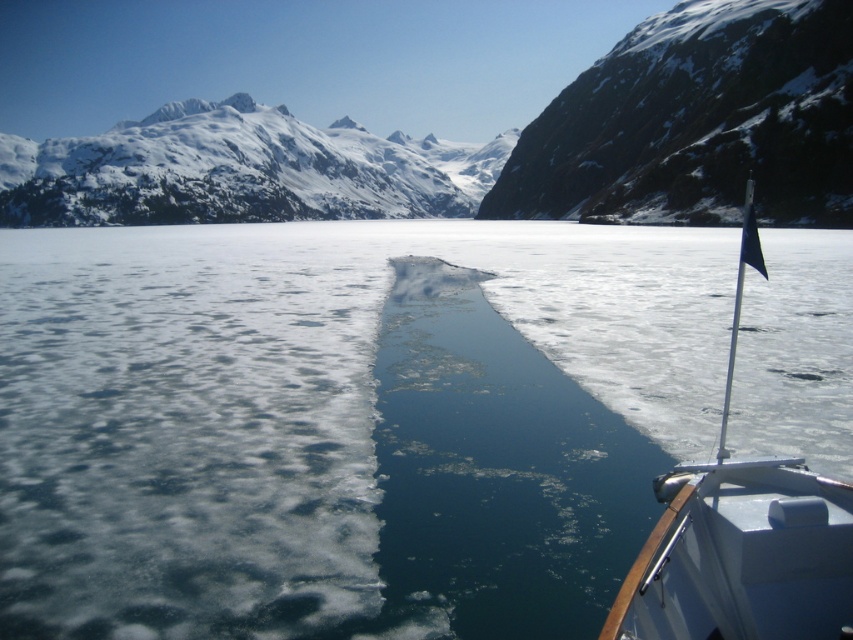
Is dark gray rocky cliff at upper right thinner than snowy granite mountain at upper left?

Yes, dark gray rocky cliff at upper right is thinner than snowy granite mountain at upper left.

Is dark gray rocky cliff at upper right smaller than snowy granite mountain at upper left?

Indeed, dark gray rocky cliff at upper right has a smaller size compared to snowy granite mountain at upper left.

What are the coordinates of `dark gray rocky cliff at upper right` in the screenshot? It's located at (698, 122).

Does clear ice at center have a smaller size compared to white glossy boat at right?

Actually, clear ice at center might be larger than white glossy boat at right.

Between point (138, 612) and point (708, 602), which one is positioned behind?

Point (138, 612)

In order to click on clear ice at center in this screenshot , I will do `click(286, 403)`.

Does point (78, 384) lie behind point (469, 172)?

No, (78, 384) is closer to viewer.

Does clear ice at center have a lesser width compared to snowy granite mountain at upper left?

Yes, clear ice at center is thinner than snowy granite mountain at upper left.

Who is more forward, (x=668, y=321) or (x=48, y=157)?

Positioned in front is point (x=668, y=321).

Locate an element on the screen. The height and width of the screenshot is (640, 853). clear ice at center is located at coordinates (286, 403).